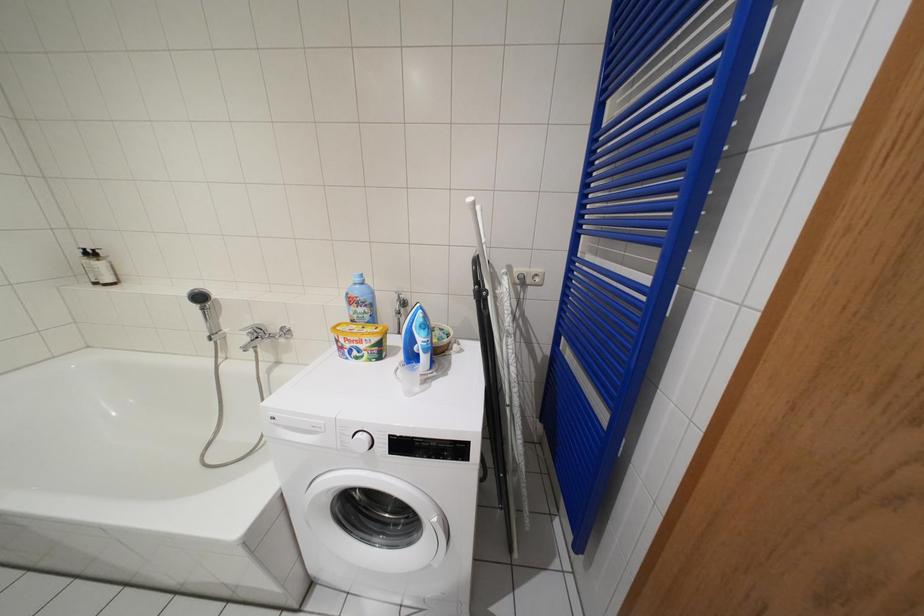
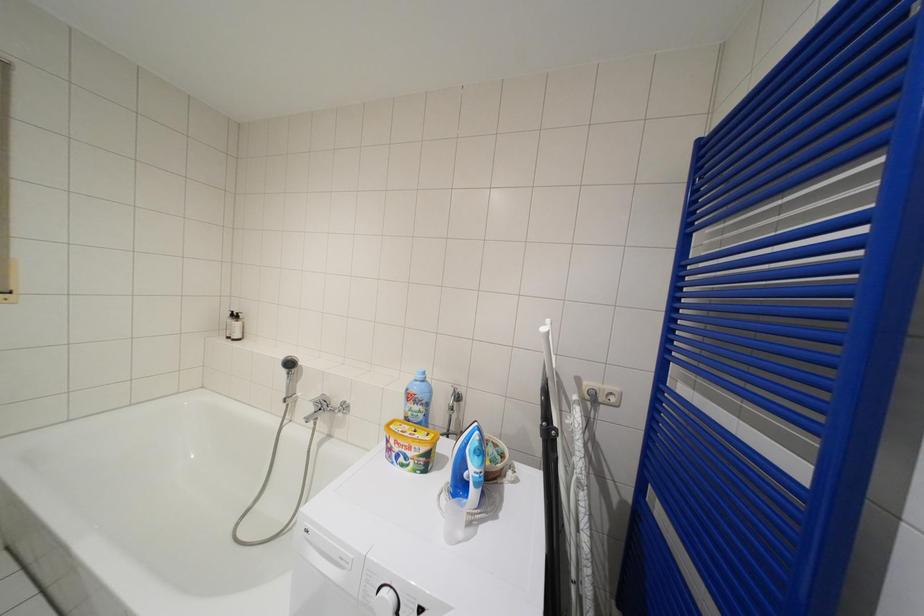
Question: In a continuous first-person perspective shot, in which direction is the camera moving?

Choices:
 (A) Left
 (B) Right
 (C) Forward
 (D) Backward

Answer: (A)